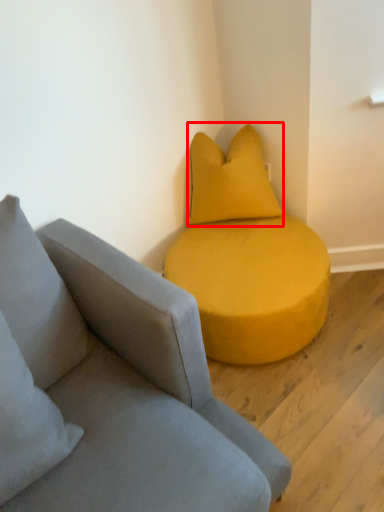
Question: From the image's perspective, considering the relative positions of pillow (annotated by the red box) and studio couch in the image provided, where is pillow (annotated by the red box) located with respect to the staircase?

Choices:
 (A) below
 (B) above

Answer: (B)